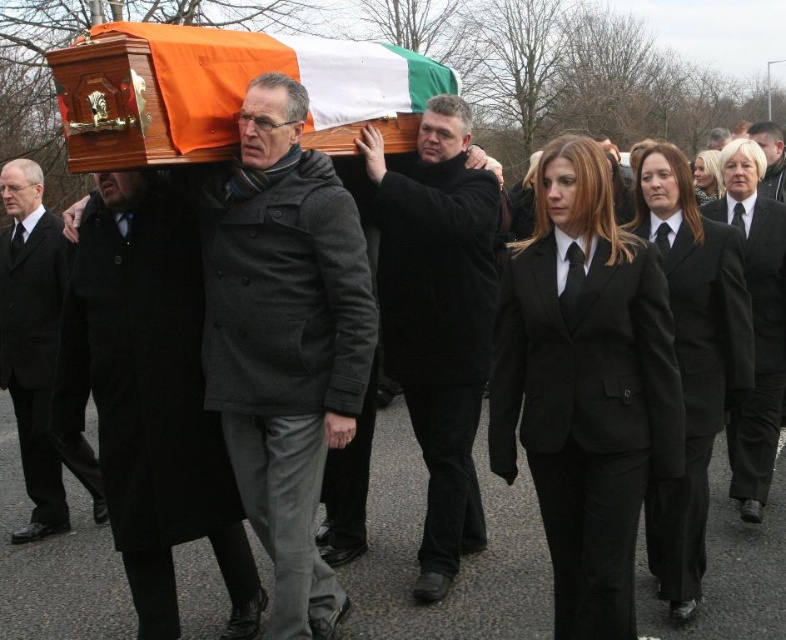
Does black wool business suit at right appear on the right side of smooth black suit at center?

Incorrect, black wool business suit at right is not on the right side of smooth black suit at center.

Where is `black wool business suit at right`? Image resolution: width=786 pixels, height=640 pixels. black wool business suit at right is located at coordinates (759, 355).

Where is `black wool business suit at right`? Image resolution: width=786 pixels, height=640 pixels. black wool business suit at right is located at coordinates (759, 355).

Who is more distant from viewer, (594,147) or (483,348)?

The point (483,348) is more distant.

Who is taller, black satin suit at center or black matte coat at center?

Standing taller between the two is black matte coat at center.

Between point (538, 429) and point (456, 499), which one is positioned behind?

The point (456, 499) is behind.

Find the location of `black satin suit at center`. black satin suit at center is located at coordinates (586, 387).

Is point (185, 296) more distant than point (432, 307)?

No, it is not.

Measure the distance between point (145, 592) and camera.

Point (145, 592) and camera are 3.50 meters apart.

The image size is (786, 640). What do you see at coordinates (151, 404) in the screenshot?
I see `black wool coat at center` at bounding box center [151, 404].

At what (x,y) coordinates should I click in order to perform the action: click on black wool coat at center. Please return your answer as a coordinate pair (x, y). The image size is (786, 640). Looking at the image, I should click on (151, 404).